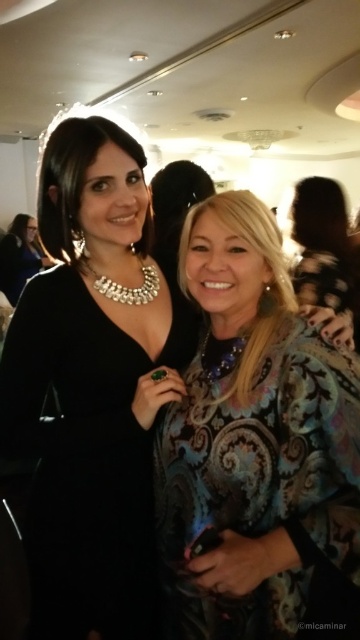
You are a photographer at a fashion show and need to arrange two dresses on a mannequin stand. The stand can only accommodate one dress at a time. You have the patterned fabric dress at center and the black velvet dress at center. Which dress should you choose to display first if you want to maximize the visibility of the intricate details of the dress?

The patterned fabric dress at center is smaller than the black velvet dress at center, so to maximize visibility of intricate details, you should display the patterned fabric dress at center first because it is smaller and can be positioned closer to the camera or lighting for better detail capture without overwhelming the frame with its size.

You are a photographer trying to capture the black velvet dress at center in the image. Given that the camera focuses on the point marked as point (86, 456), will the dress be in focus?

Yes, the point (86, 456) marks the black velvet dress at center, so the camera will focus on the dress.

From the picture: You are a photographer trying to focus on the black velvet dress at center and the matte black dress at center. Which dress should you adjust your camera focus to first to ensure both are in focus?

The black velvet dress at center is closer to the viewer than the matte black dress at center, so you should focus on the black velvet dress at center first to ensure both are in focus.